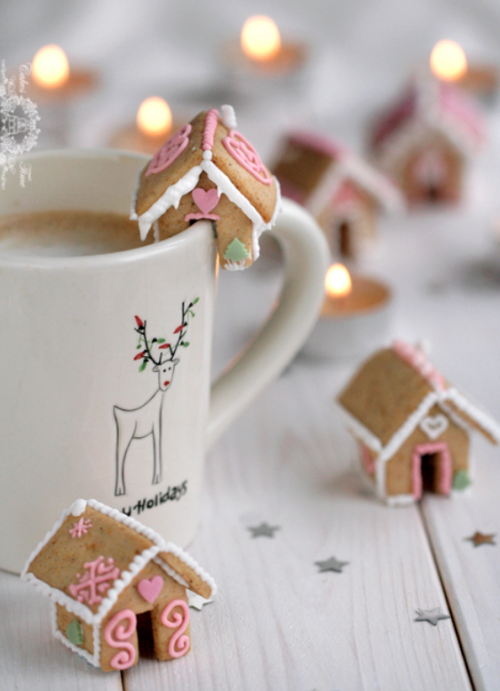
Locate an element on the screen. 4 red christmas lights is located at coordinates (139, 321), (136, 350), (161, 345), (178, 328).